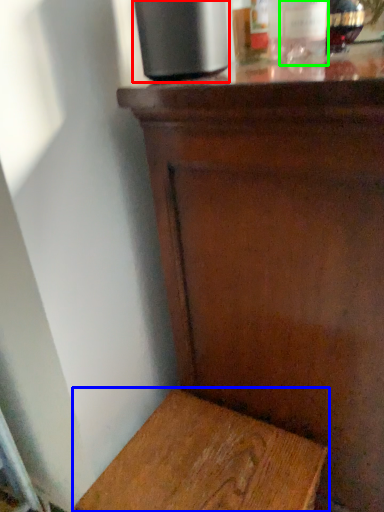
Question: Estimate the real-world distances between objects in this image. Which object is closer to appliance (highlighted by a red box), furniture (highlighted by a blue box) or bottle (highlighted by a green box)?

Choices:
 (A) furniture
 (B) bottle

Answer: (B)